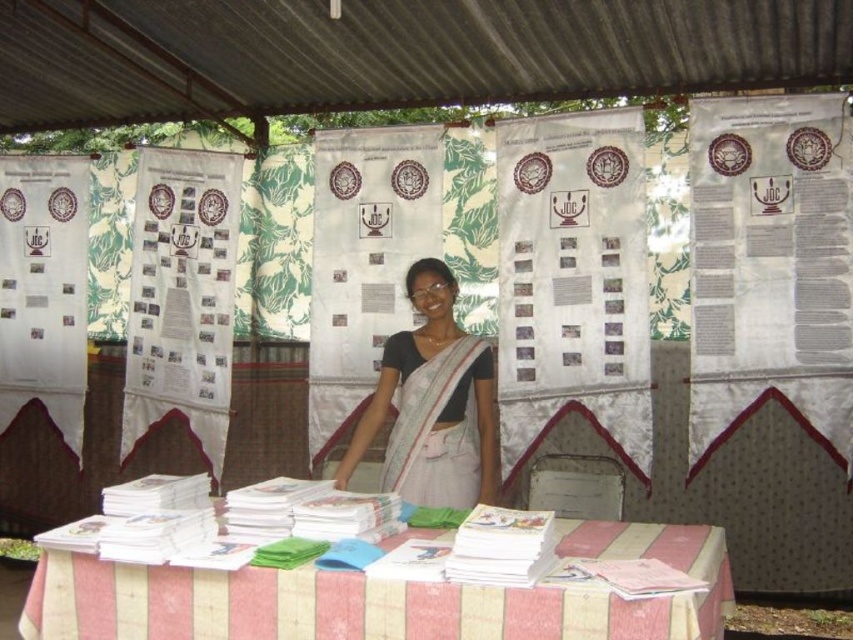
You are an event organizer who needs to place a 12 inch wide decorative item between the white striped fabric at lower center and the white silk saree at center on the table. Can you fit it without overlapping either item?

The distance between the white striped fabric at lower center and the white silk saree at center is 32.66 inches. Since the decorative item is only 12 inches wide, there is sufficient space to place it between them without overlapping either item.

You are an attendee at the event and want to pick up a brochure from the table. The table has a white striped fabric at lower center and a white silk saree at center. Which item is closer to the left edge of the table?

The white striped fabric at lower center is to the left of the white silk saree at center, so it is closer to the left edge of the table.